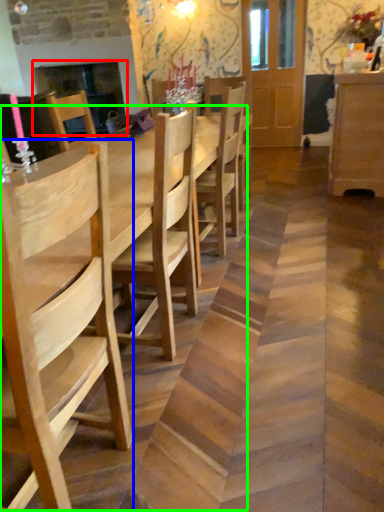
Question: Which is farther away from fireplace (highlighted by a red box)? chair (highlighted by a blue box) or table (highlighted by a green box)?

Choices:
 (A) chair
 (B) table

Answer: (A)